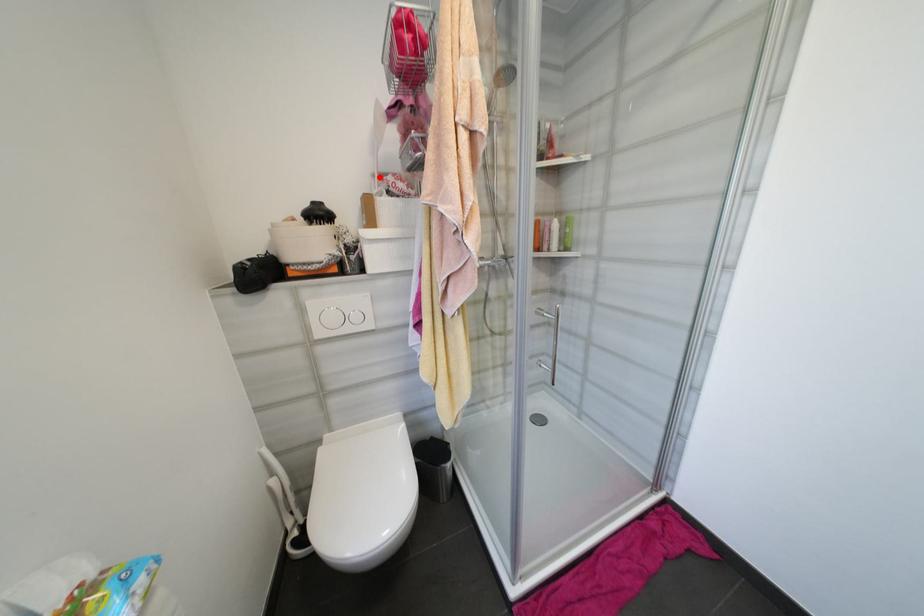
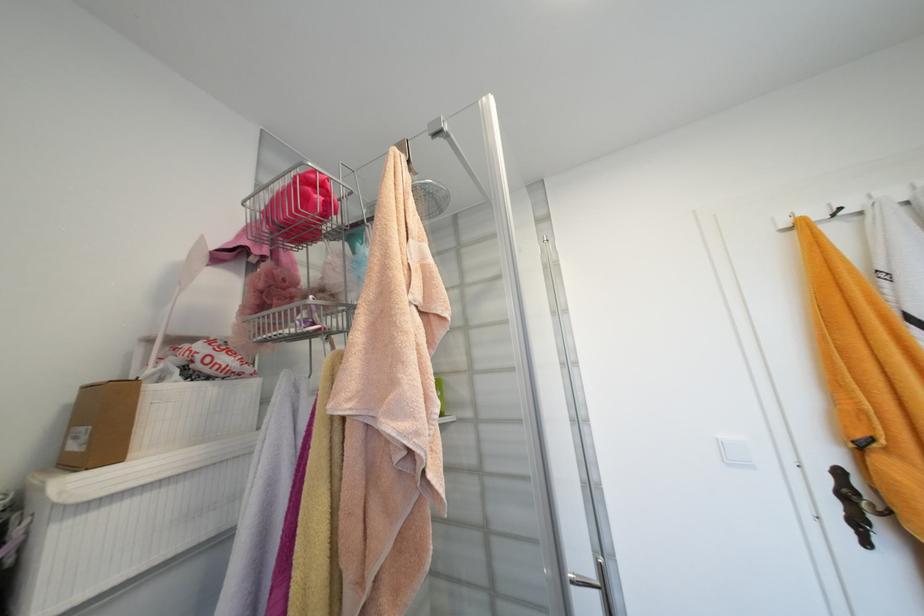
Locate, in the second image, the point that corresponds to the highlighted location in the first image.

(154, 342)